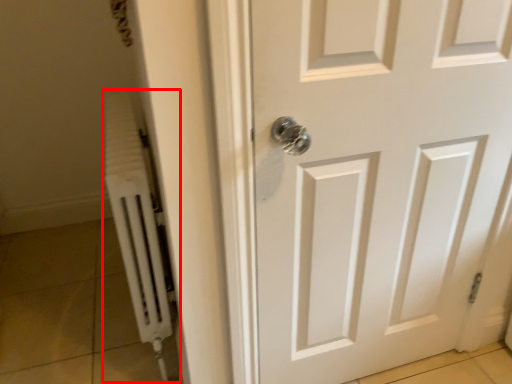
Question: Observing the image, what is the correct spatial positioning of radiator (annotated by the red box) in reference to door?

Choices:
 (A) right
 (B) left

Answer: (B)